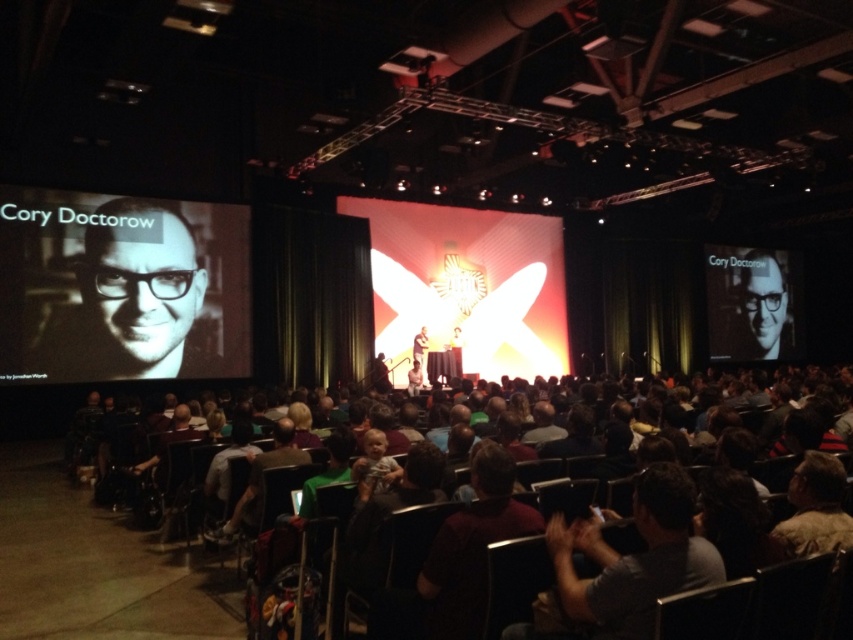
Does dark brown leather chairs at lower center appear under matte black laptop at center?

Yes, dark brown leather chairs at lower center is below matte black laptop at center.

Can you confirm if dark brown leather chairs at lower center is thinner than matte black laptop at center?

No.

Identify the location of dark brown leather chairs at lower center. (514, 556).

Locate an element on the screen. The height and width of the screenshot is (640, 853). dark brown leather chairs at lower center is located at coordinates (514, 556).

Between matte black screen at left and matte black laptop at center, which one is positioned higher?

matte black screen at left is higher up.

Can you confirm if matte black screen at left is positioned above matte black laptop at center?

Yes, matte black screen at left is above matte black laptop at center.

Between point (245, 328) and point (425, 330), which one is positioned in front?

Point (245, 328) is in front.

This screenshot has height=640, width=853. Identify the location of matte black screen at left. (120, 288).

Does dark brown leather chairs at lower center appear on the right side of matte black glasses at upper right?

No, dark brown leather chairs at lower center is not to the right of matte black glasses at upper right.

Who is positioned more to the right, dark brown leather chairs at lower center or matte black glasses at upper right?

matte black glasses at upper right is more to the right.

Is point (354, 492) closer to camera compared to point (751, 291)?

Yes.

Identify the location of dark brown leather chairs at lower center. (514, 556).